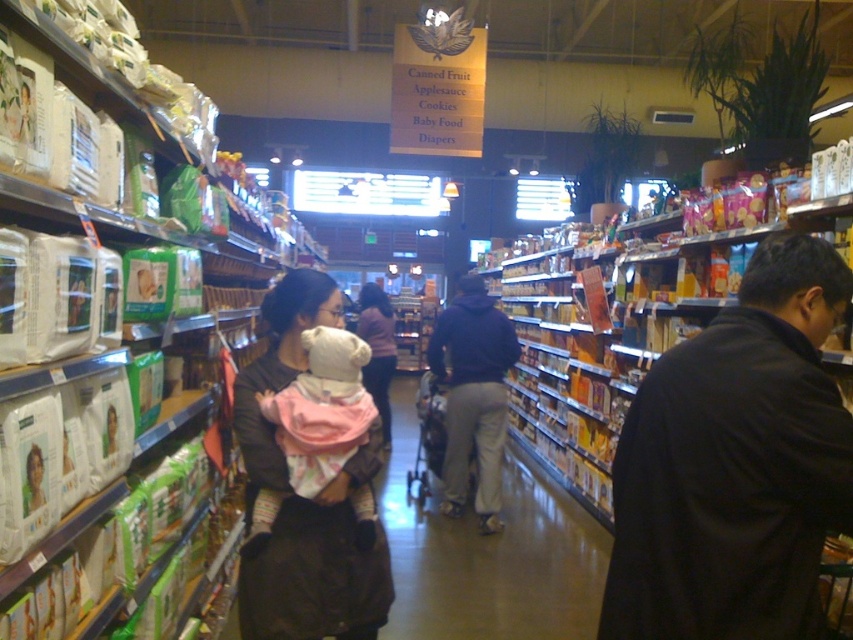
Question: Which object is the closest to the black matte jacket at right?

Choices:
 (A) pink fabric baby at center
 (B) matte pink sweater at center
 (C) dark blue hoodie at center

Answer: (A)

Question: Is black matte jacket at right wider than matte pink sweater at center?

Choices:
 (A) yes
 (B) no

Answer: (A)

Question: Can you confirm if pink fabric baby at center is positioned above matte pink sweater at center?

Choices:
 (A) no
 (B) yes

Answer: (A)

Question: Among these objects, which one is farthest from the camera?

Choices:
 (A) pink fabric baby at center
 (B) dark blue hoodie at center
 (C) black matte jacket at right
 (D) matte pink sweater at center

Answer: (D)

Question: Which of the following is the farthest from the observer?

Choices:
 (A) (492, 381)
 (B) (254, 504)

Answer: (A)

Question: Does black matte jacket at right come behind matte pink sweater at center?

Choices:
 (A) no
 (B) yes

Answer: (A)